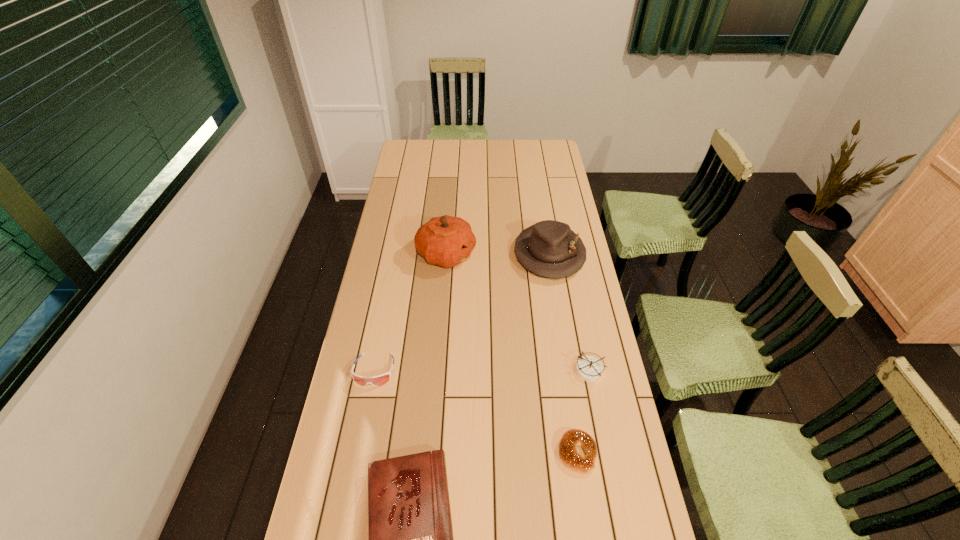
Locate an element on the screen. The height and width of the screenshot is (540, 960). pumpkin is located at coordinates (446, 241).

At what (x,y) coordinates should I click in order to perform the action: click on the fifth shortest object. Please return your answer as a coordinate pair (x, y). The width and height of the screenshot is (960, 540). Looking at the image, I should click on (549, 248).

At what (x,y) coordinates should I click in order to perform the action: click on compass. Please return your answer as a coordinate pair (x, y). This screenshot has height=540, width=960. Looking at the image, I should click on (590, 369).

Locate an element on the screen. The height and width of the screenshot is (540, 960). goggles is located at coordinates (378, 380).

Locate an element on the screen. This screenshot has width=960, height=540. bagel is located at coordinates (573, 438).

At what (x,y) coordinates should I click in order to perform the action: click on vacant space located 0.100m on the front-facing side of the tallest object. Please return your answer as a coordinate pair (x, y). This screenshot has width=960, height=540. Looking at the image, I should click on (501, 254).

The width and height of the screenshot is (960, 540). In order to click on vacant area situated on the decorative side of the second tallest object in this screenshot , I will do `click(565, 354)`.

You are a GUI agent. You are given a task and a screenshot of the screen. Output one action in this format:
    pyautogui.click(x=<x>, y=<y>)
    Task: Click on the vacant space located 0.180m on the back of the compass
    The image size is (960, 540).
    Given the screenshot: What is the action you would take?
    pyautogui.click(x=579, y=315)

The height and width of the screenshot is (540, 960). Identify the location of free space located 0.060m on the front-facing side of the goggles. (367, 407).

What are the coordinates of `vacant space located 0.090m on the front of the bagel` in the screenshot? It's located at (587, 512).